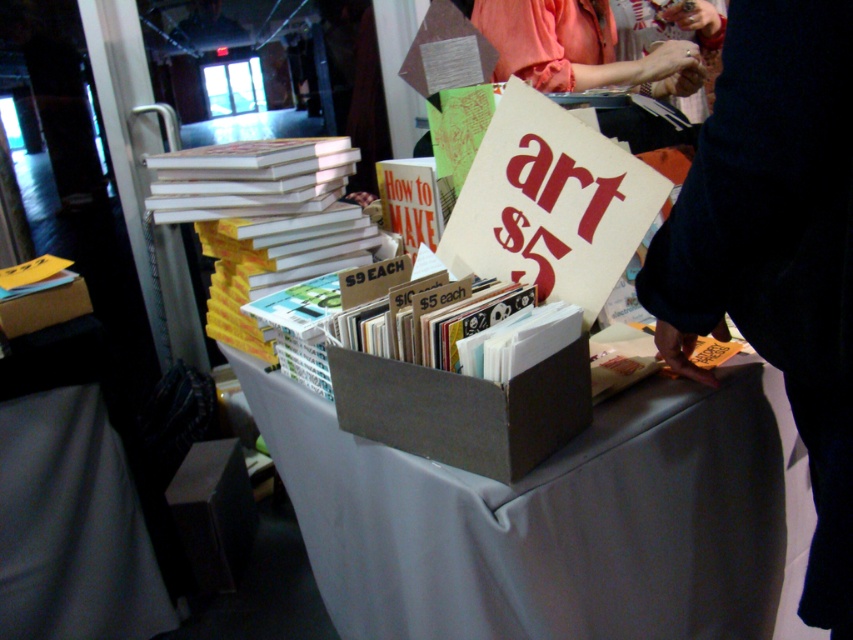
You are a customer at the market and want to pick up the dark blue sweater at upper right. Based on its location, can you estimate where on the table it is positioned relative to the other items?

The dark blue sweater at upper right is located at point coordinates approximately 0.391 on the x axis and 0.911 on the y axis, which places it near the upper right corner of the table.

You are standing at the edge of the table looking towards the center. Where exactly are the yellow paperbacks at center located in terms of coordinates?

The yellow paperbacks at center are located at the 2D coordinates point (263, 220).

You are standing at the edge of the table looking towards the center. There are two points marked on the table surface. The first point is at position point (793, 125) and the second point is at point (286, 253). Which point is closer to you?

Point (793, 125) is closer to you because it is in front of point (286, 253).